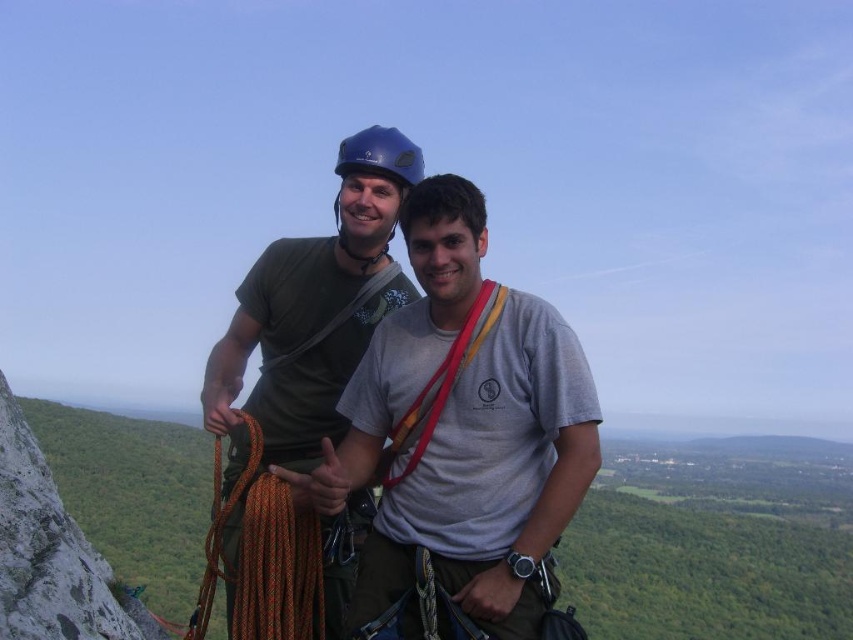
Which is more to the left, matte green shirt at center or orange braided rope at center?

orange braided rope at center is more to the left.

You are a GUI agent. You are given a task and a screenshot of the screen. Output one action in this format:
    pyautogui.click(x=<x>, y=<y>)
    Task: Click on the matte green shirt at center
    
    Given the screenshot: What is the action you would take?
    pyautogui.click(x=314, y=305)

Between point (270, 330) and point (256, 476), which one is positioned behind?

Positioned behind is point (270, 330).

At what (x,y) coordinates should I click in order to perform the action: click on matte green shirt at center. Please return your answer as a coordinate pair (x, y). The height and width of the screenshot is (640, 853). Looking at the image, I should click on (314, 305).